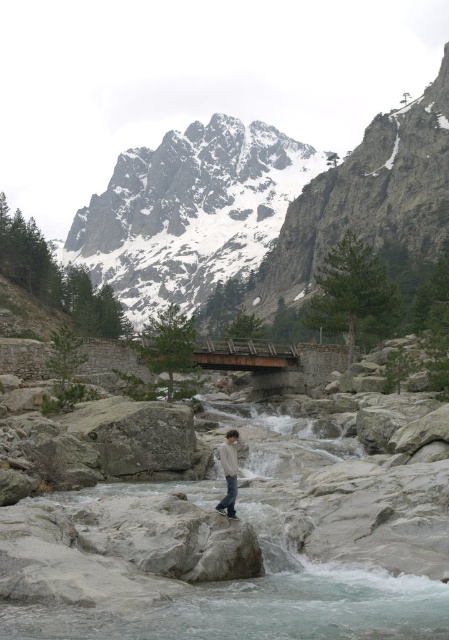
You are a hiker standing at the riverbed in the image. You want to take a photo of the snowy granite mountain at upper center. Which direction should you face to ensure the mountain is in the frame?

The snowy granite mountain at upper center is located at point 0.322 on the horizontal axis and 0.584 on the vertical axis. Since the mountain is in the upper center position, you should face upwards and towards the center of the image to capture it in your photo.

In the scene shown: You are a hiker planning to take a photo of the snowy granite mountain at upper center and the light gray sweater at center. Which object should you focus on first if you want both to be in sharp focus?

To ensure both the snowy granite mountain at upper center and the light gray sweater at center are in sharp focus, you should focus on the light gray sweater at center first since it is closer to the camera than the snowy granite mountain at upper center.

You are a hiker who wants to take a photo of the snowy granite mountain at upper center and the light gray sweater at center. Which object should you focus on first to ensure both are in the frame?

The snowy granite mountain at upper center is bigger than the light gray sweater at center, so you should focus on the snowy granite mountain at upper center first to ensure both are in the frame.